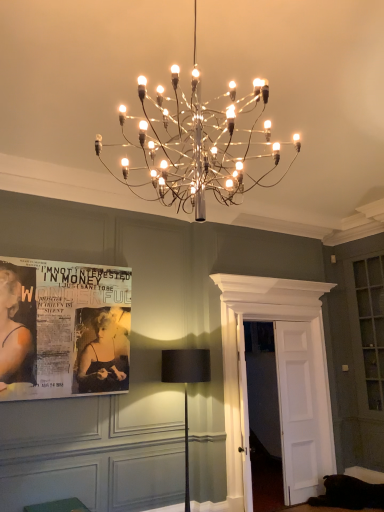
What is the approximate height of black fabric lamp at center, which is the second lamp in front-to-back order?

black fabric lamp at center, which is the second lamp in front-to-back order, is 5.54 feet tall.

What do you see at coordinates (58, 506) in the screenshot?
I see `green fabric cushion at lower left` at bounding box center [58, 506].

The height and width of the screenshot is (512, 384). I want to click on metallic wire chandelier at upper center, which is the 2th lamp in bottom-to-top order, so click(198, 143).

Does metallic wire chandelier at upper center, the 1th lamp when ordered from top to bottom, lie behind black paper poster at left?

No, it is in front of black paper poster at left.

From a real-world perspective, between metallic wire chandelier at upper center, which is the 2th lamp in bottom-to-top order, and black paper poster at left, who is vertically higher?

metallic wire chandelier at upper center, which is the 2th lamp in bottom-to-top order, from a real-world perspective.

Looking at their sizes, would you say metallic wire chandelier at upper center, which is the first lamp from front to back, is wider or thinner than black paper poster at left?

Clearly, metallic wire chandelier at upper center, which is the first lamp from front to back, has more width compared to black paper poster at left.

There is a black paper poster at left. Where is `lamp above it (from a real-world perspective)`? The width and height of the screenshot is (384, 512). lamp above it (from a real-world perspective) is located at coordinates pyautogui.click(x=198, y=143).

Are green fabric cushion at lower left and black paper poster at left beside each other?

There is a gap between green fabric cushion at lower left and black paper poster at left.

Is green fabric cushion at lower left bigger than black paper poster at left?

No, green fabric cushion at lower left is not bigger than black paper poster at left.

Is point (72, 510) more distant than point (2, 260)?

That is False.

Based on the photo, considering the relative positions of green fabric cushion at lower left and black paper poster at left in the image provided, is green fabric cushion at lower left to the left of black paper poster at left from the viewer's perspective?

In fact, green fabric cushion at lower left is to the right of black paper poster at left.

Does black paper poster at left have a lesser height compared to metallic wire chandelier at upper center, the second lamp in the back-to-front sequence?

No.

In the scene shown: In terms of width, does black paper poster at left look wider or thinner when compared to metallic wire chandelier at upper center, the second lamp in the back-to-front sequence?

Clearly, black paper poster at left has less width compared to metallic wire chandelier at upper center, the second lamp in the back-to-front sequence.

Does black paper poster at left lie in front of metallic wire chandelier at upper center, which is the first lamp from front to back?

No, black paper poster at left is further to the viewer.

Based on the photo, is black paper poster at left touching metallic wire chandelier at upper center, which is the first lamp from front to back?

No, black paper poster at left is not next to metallic wire chandelier at upper center, which is the first lamp from front to back.

How different are the orientations of black paper poster at left and green fabric cushion at lower left in degrees?

0.474 degrees separate the facing orientations of black paper poster at left and green fabric cushion at lower left.

Is black paper poster at left taller than green fabric cushion at lower left?

Indeed, black paper poster at left has a greater height compared to green fabric cushion at lower left.

Is the depth of black paper poster at left less than that of green fabric cushion at lower left?

No, it is behind green fabric cushion at lower left.

Is the surface of black paper poster at left in direct contact with black fabric lamp at center, which is the second lamp in front-to-back order?

black paper poster at left and black fabric lamp at center, which is the second lamp in front-to-back order, are clearly separated.

Is black paper poster at left thinner than black fabric lamp at center, which is counted as the first lamp, starting from the bottom?

Indeed, black paper poster at left has a lesser width compared to black fabric lamp at center, which is counted as the first lamp, starting from the bottom.

What's the angular difference between black paper poster at left and black fabric lamp at center, which is the second lamp in front-to-back order,'s facing directions?

0.288 degrees.

Based on the photo, would you say black paper poster at left is to the left or to the right of black fabric lamp at center, marked as the second lamp in a top-to-bottom arrangement, in the picture?

black paper poster at left is positioned on black fabric lamp at center, marked as the second lamp in a top-to-bottom arrangement,'s left side.

Considering the relative sizes of black fabric lamp at center, marked as the second lamp in a top-to-bottom arrangement, and black paper poster at left in the image provided, is black fabric lamp at center, marked as the second lamp in a top-to-bottom arrangement, wider than black paper poster at left?

Indeed, black fabric lamp at center, marked as the second lamp in a top-to-bottom arrangement, has a greater width compared to black paper poster at left.

Can you confirm if black fabric lamp at center, which is counted as the first lamp, starting from the bottom, is positioned to the right of black paper poster at left?

Yes.

Which of these two, black fabric lamp at center, marked as the second lamp in a top-to-bottom arrangement, or black paper poster at left, is smaller?

black paper poster at left.

Is the position of black fabric lamp at center, the first lamp in the back-to-front sequence, more distant than that of black paper poster at left?

No, the depth of black fabric lamp at center, the first lamp in the back-to-front sequence, is less than that of black paper poster at left.

Is black fabric lamp at center, marked as the second lamp in a top-to-bottom arrangement, to the right of green fabric cushion at lower left from the viewer's perspective?

Yes.

Who is more distant, black fabric lamp at center, which is the second lamp in front-to-back order, or green fabric cushion at lower left?

black fabric lamp at center, which is the second lamp in front-to-back order.

Measure the distance between black fabric lamp at center, which is the second lamp in front-to-back order, and green fabric cushion at lower left.

black fabric lamp at center, which is the second lamp in front-to-back order, and green fabric cushion at lower left are 4.95 feet apart.

Could green fabric cushion at lower left be considered to be inside black fabric lamp at center, the first lamp in the back-to-front sequence?

No, green fabric cushion at lower left is not surrounded by black fabric lamp at center, the first lamp in the back-to-front sequence.

The image size is (384, 512). I want to click on lamp above the black paper poster at left (from a real-world perspective), so click(198, 143).

Where is `furniture in front of the black paper poster at left`? The height and width of the screenshot is (512, 384). furniture in front of the black paper poster at left is located at coordinates (58, 506).

When comparing their distances from green fabric cushion at lower left, does metallic wire chandelier at upper center, which is the first lamp from front to back, or black paper poster at left seem further?

The object further to green fabric cushion at lower left is metallic wire chandelier at upper center, which is the first lamp from front to back.

When comparing their distances from metallic wire chandelier at upper center, the second lamp in the back-to-front sequence, does black paper poster at left or green fabric cushion at lower left seem further?

green fabric cushion at lower left lies further to metallic wire chandelier at upper center, the second lamp in the back-to-front sequence, than the other object.

Considering their positions, is green fabric cushion at lower left positioned closer to metallic wire chandelier at upper center, the 1th lamp when ordered from top to bottom, than black fabric lamp at center, marked as the second lamp in a top-to-bottom arrangement?

The object closer to metallic wire chandelier at upper center, the 1th lamp when ordered from top to bottom, is black fabric lamp at center, marked as the second lamp in a top-to-bottom arrangement.

From the image, which object appears to be nearer to black fabric lamp at center, the first lamp in the back-to-front sequence, green fabric cushion at lower left or black paper poster at left?

black paper poster at left.

Which object lies further to the anchor point metallic wire chandelier at upper center, the 1th lamp when ordered from top to bottom, black fabric lamp at center, which is counted as the first lamp, starting from the bottom, or black paper poster at left?

black fabric lamp at center, which is counted as the first lamp, starting from the bottom, is positioned further to the anchor metallic wire chandelier at upper center, the 1th lamp when ordered from top to bottom.

Based on their spatial positions, is metallic wire chandelier at upper center, which is the first lamp from front to back, or green fabric cushion at lower left further from black fabric lamp at center, the first lamp in the back-to-front sequence?

metallic wire chandelier at upper center, which is the first lamp from front to back, is positioned further to the anchor black fabric lamp at center, the first lamp in the back-to-front sequence.

Which object lies further to the anchor point black fabric lamp at center, marked as the second lamp in a top-to-bottom arrangement, black paper poster at left or green fabric cushion at lower left?

green fabric cushion at lower left is further to black fabric lamp at center, marked as the second lamp in a top-to-bottom arrangement.

Based on their spatial positions, is black fabric lamp at center, the first lamp in the back-to-front sequence, or metallic wire chandelier at upper center, the 1th lamp when ordered from top to bottom, further from black paper poster at left?

The object further to black paper poster at left is metallic wire chandelier at upper center, the 1th lamp when ordered from top to bottom.

Find the location of a particular element. lamp between metallic wire chandelier at upper center, the second lamp in the back-to-front sequence, and black paper poster at left from front to back is located at coordinates (186, 385).

Locate an element on the screen. The image size is (384, 512). lamp between metallic wire chandelier at upper center, which is the 2th lamp in bottom-to-top order, and green fabric cushion at lower left vertically is located at coordinates (186, 385).

Find the location of `lamp between black paper poster at left and green fabric cushion at lower left from top to bottom`. lamp between black paper poster at left and green fabric cushion at lower left from top to bottom is located at coordinates (186, 385).

Where is `poster page between metallic wire chandelier at upper center, the second lamp in the back-to-front sequence, and green fabric cushion at lower left from top to bottom`? poster page between metallic wire chandelier at upper center, the second lamp in the back-to-front sequence, and green fabric cushion at lower left from top to bottom is located at coordinates (63, 329).